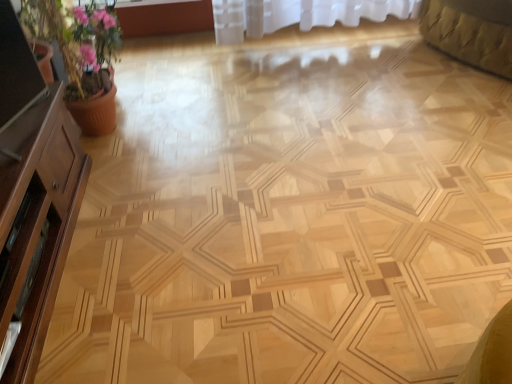
What do you see at coordinates (31, 272) in the screenshot?
I see `matte wooden screen door at left` at bounding box center [31, 272].

Where is `pink clay pot at left`? This screenshot has width=512, height=384. pink clay pot at left is located at coordinates (81, 57).

Where is `brown wood dresser at left`? brown wood dresser at left is located at coordinates (37, 224).

How far apart are matte wooden screen door at left and pink clay pot at left?

The distance of matte wooden screen door at left from pink clay pot at left is 30.48 inches.

Is matte wooden screen door at left wider than pink clay pot at left?

In fact, matte wooden screen door at left might be narrower than pink clay pot at left.

Which is more to the right, matte wooden screen door at left or pink clay pot at left?

From the viewer's perspective, matte wooden screen door at left appears more on the right side.

In the scene shown: Is matte wooden screen door at left beside pink clay pot at left?

There is a gap between matte wooden screen door at left and pink clay pot at left.

Considering the relative positions of pink clay pot at left and brown wood dresser at left in the image provided, is pink clay pot at left to the left of brown wood dresser at left from the viewer's perspective?

In fact, pink clay pot at left is to the right of brown wood dresser at left.

Does pink clay pot at left have a smaller size compared to brown wood dresser at left?

No.

Can you confirm if pink clay pot at left is wider than brown wood dresser at left?

Correct, the width of pink clay pot at left exceeds that of brown wood dresser at left.

Is matte wooden screen door at left positioned behind brown wood dresser at left?

That is True.

Who is shorter, matte wooden screen door at left or brown wood dresser at left?

Standing shorter between the two is matte wooden screen door at left.

Is matte wooden screen door at left smaller than brown wood dresser at left?

Yes.

From a real-world perspective, who is located lower, matte wooden screen door at left or brown wood dresser at left?

matte wooden screen door at left is physically lower.

Considering the sizes of pink clay pot at left and matte wooden screen door at left in the image, is pink clay pot at left wider or thinner than matte wooden screen door at left?

Considering their sizes, pink clay pot at left looks broader than matte wooden screen door at left.

Identify the location of houseplant lying on the left of matte wooden screen door at left. (81, 57).

Is pink clay pot at left surrounding matte wooden screen door at left?

No, matte wooden screen door at left is located outside of pink clay pot at left.

Who is smaller, pink clay pot at left or matte wooden screen door at left?

matte wooden screen door at left.

Considering the relative positions of brown wood dresser at left and matte wooden screen door at left in the image provided, is brown wood dresser at left to the left or to the right of matte wooden screen door at left?

In the image, brown wood dresser at left appears on the left side of matte wooden screen door at left.

Could you tell me if brown wood dresser at left is turned towards matte wooden screen door at left?

Yes, brown wood dresser at left is turned towards matte wooden screen door at left.

Does brown wood dresser at left have a smaller size compared to matte wooden screen door at left?

No, brown wood dresser at left is not smaller than matte wooden screen door at left.

What's the angular difference between brown wood dresser at left and matte wooden screen door at left's facing directions?

The angular difference between brown wood dresser at left and matte wooden screen door at left is 0.000355 degrees.

Does brown wood dresser at left have a lesser height compared to pink clay pot at left?

Indeed, brown wood dresser at left has a lesser height compared to pink clay pot at left.

From a real-world perspective, between brown wood dresser at left and pink clay pot at left, who is vertically lower?

In real-world perspective, brown wood dresser at left is lower.

The image size is (512, 384). I want to click on houseplant that is behind the brown wood dresser at left, so click(x=81, y=57).

In the image, there is a pink clay pot at left. At what (x,y) coordinates should I click in order to perform the action: click on screen door below it (from the image's perspective). Please return your answer as a coordinate pair (x, y). The height and width of the screenshot is (384, 512). Looking at the image, I should click on (31, 272).

I want to click on houseplant on the right side of brown wood dresser at left, so click(81, 57).

Which object lies further to the anchor point pink clay pot at left, matte wooden screen door at left or brown wood dresser at left?

matte wooden screen door at left is further to pink clay pot at left.

Considering their positions, is matte wooden screen door at left positioned further to brown wood dresser at left than pink clay pot at left?

Based on the image, pink clay pot at left appears to be further to brown wood dresser at left.

From the image, which object appears to be nearer to matte wooden screen door at left, brown wood dresser at left or pink clay pot at left?

brown wood dresser at left is closer to matte wooden screen door at left.

Which object lies nearer to the anchor point brown wood dresser at left, pink clay pot at left or matte wooden screen door at left?

matte wooden screen door at left is closer to brown wood dresser at left.

From the image, which object appears to be farther from matte wooden screen door at left, pink clay pot at left or brown wood dresser at left?

pink clay pot at left is further to matte wooden screen door at left.

When comparing their distances from pink clay pot at left, does brown wood dresser at left or matte wooden screen door at left seem closer?

brown wood dresser at left is positioned closer to the anchor pink clay pot at left.

What are the coordinates of `dresser between pink clay pot at left and matte wooden screen door at left in the up-down direction` in the screenshot? It's located at (37, 224).